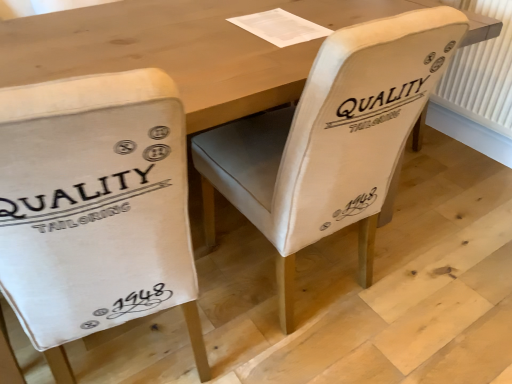
Find the location of a particular element. The width and height of the screenshot is (512, 384). empty space that is to the right of white fabric chair at center, which appears as the first chair when viewed from the right is located at coordinates (439, 288).